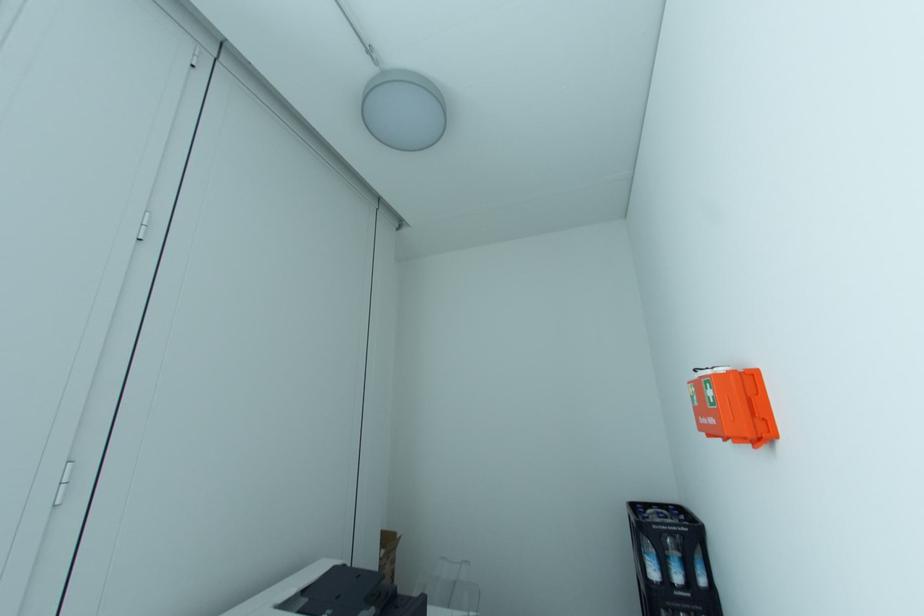
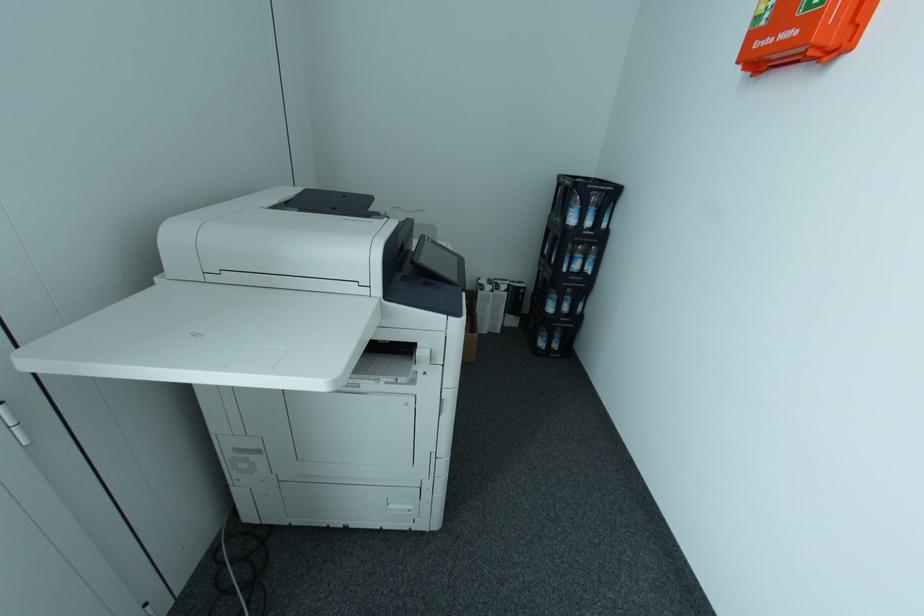
Consider the image. The first image is from the beginning of the video and the second image is from the end. How did the camera likely rotate when shooting the video?

The camera rotated toward right-down.